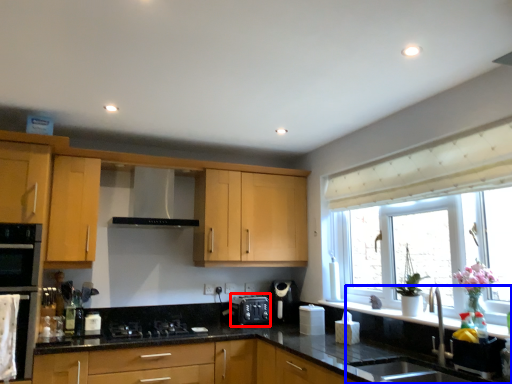
Question: Among these objects, which one is nearest to the camera, appliance (highlighted by a red box) or sink (highlighted by a blue box)?

Choices:
 (A) appliance
 (B) sink

Answer: (B)